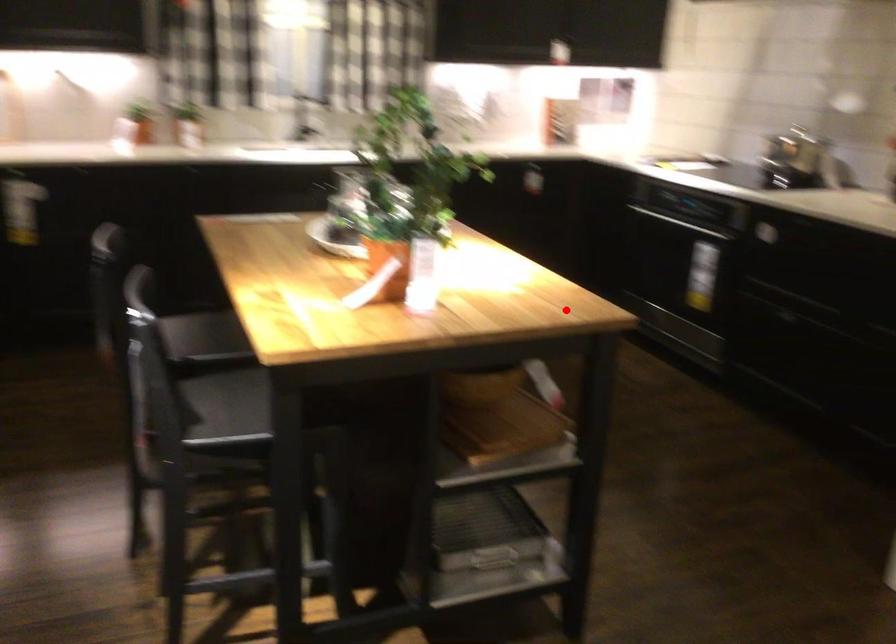
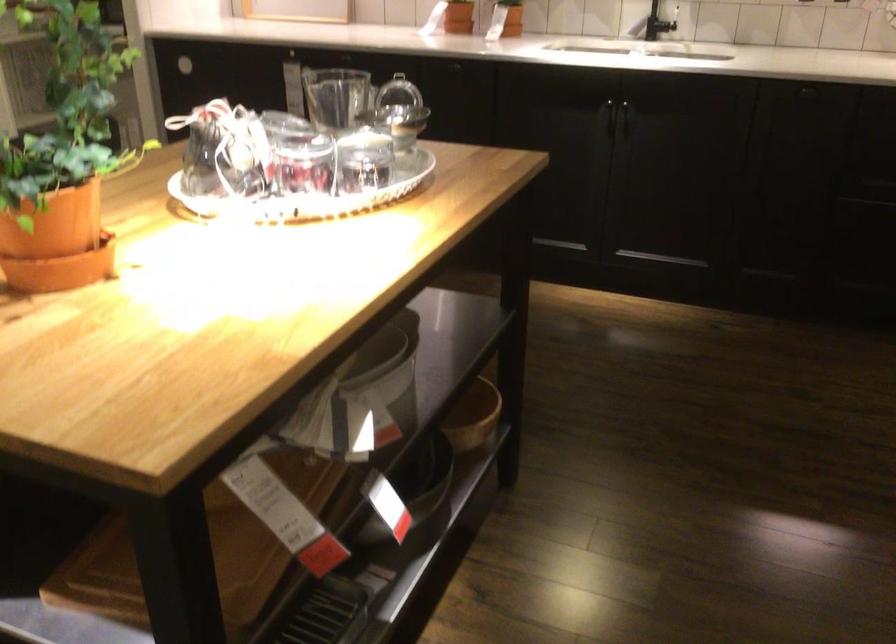
Question: I am providing you with two images of the same scene from different viewpoints. A red point is shown in image1. For the corresponding object point in image2, is it positioned nearer or farther from the camera?

Choices:
 (A) Nearer
 (B) Farther

Answer: (A)